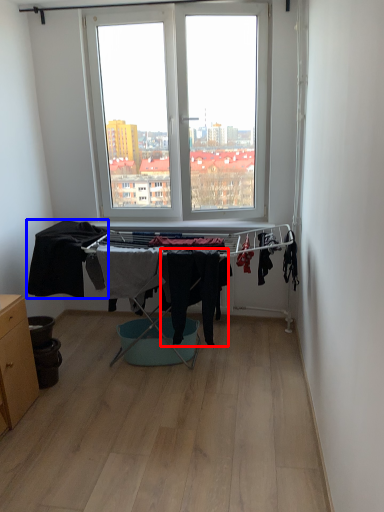
Question: Which point is closer to the camera, clothing (highlighted by a red box) or clothing (highlighted by a blue box)?

Choices:
 (A) clothing
 (B) clothing

Answer: (A)